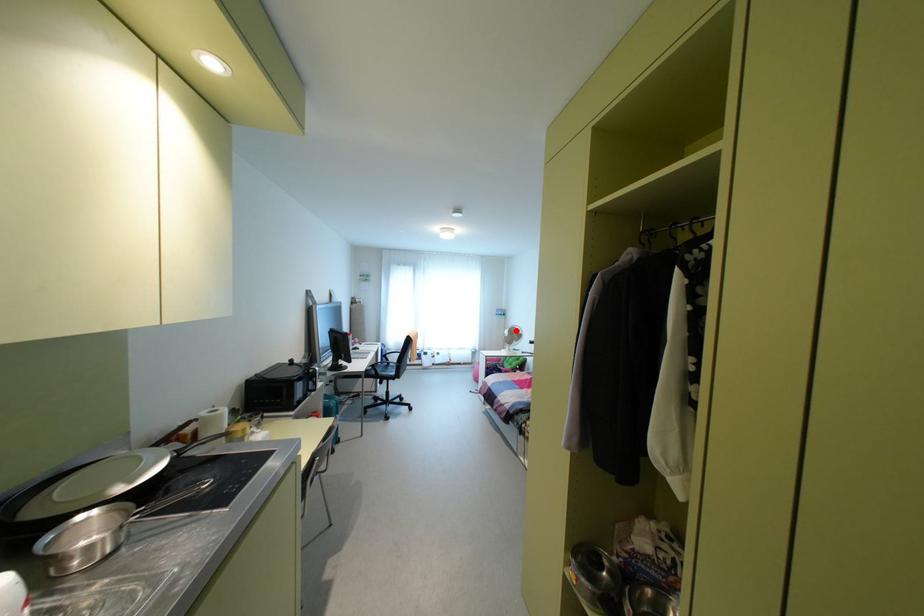
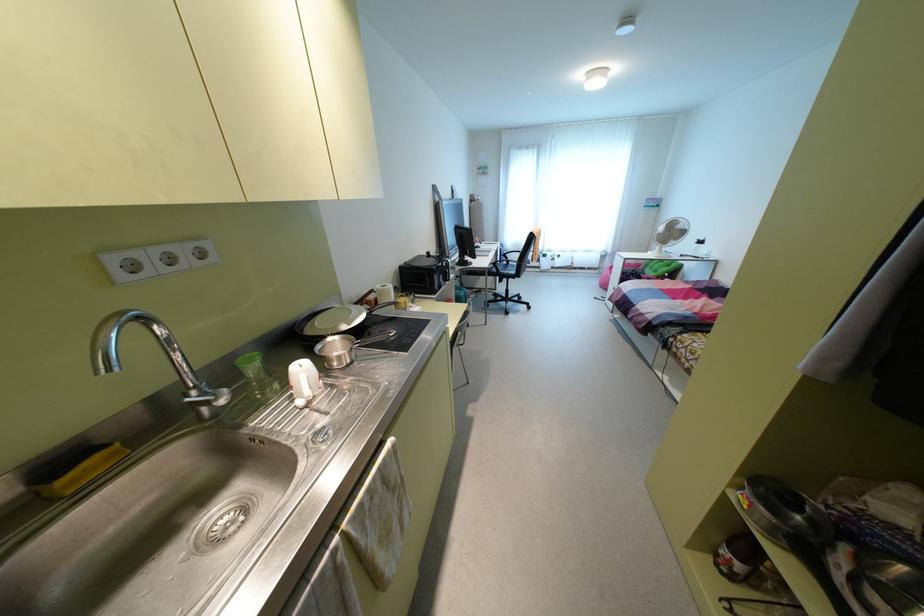
The point at the highlighted location is marked in the first image. Where is the corresponding point in the second image?

(679, 225)